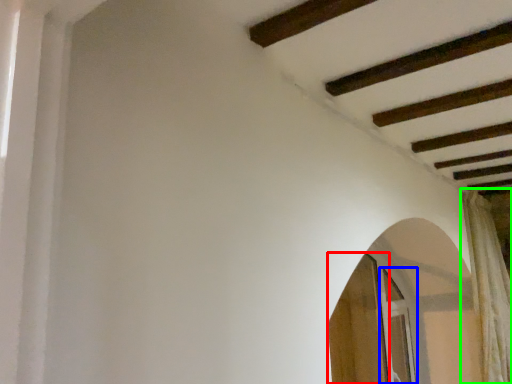
Question: Estimate the real-world distances between objects in this image. Which object is farther from screen door (highlighted by a red box), screen door (highlighted by a blue box) or curtain (highlighted by a green box)?

Choices:
 (A) screen door
 (B) curtain

Answer: (B)